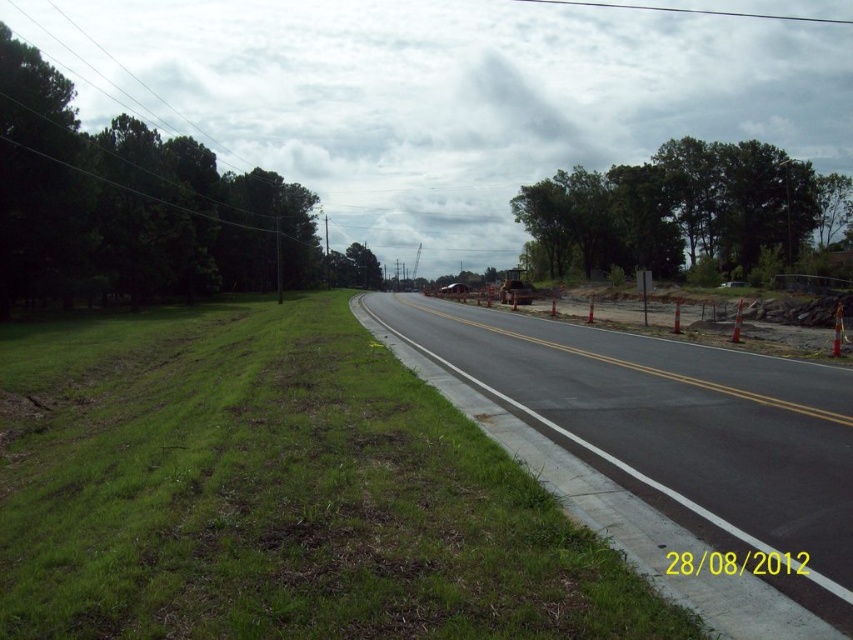
You are driving a car and need to park on the side of the road. Based on the scene, which area would be more suitable for parking between the green grass at lower left and the asphalt road at center?

The asphalt road at center is more suitable for parking because the green grass at lower left is located below it and might be unstable due to construction activity mentioned in the scene.

You are driving a car and want to park near the construction site. Based on the scene, which object, the green grass at lower left or the asphalt road at center, is a safer place to park considering proximity to the construction area?

The green grass at lower left is closer to the viewer than the asphalt road at center, so parking there would be safer as it is farther from the construction zone on the right side of the road.